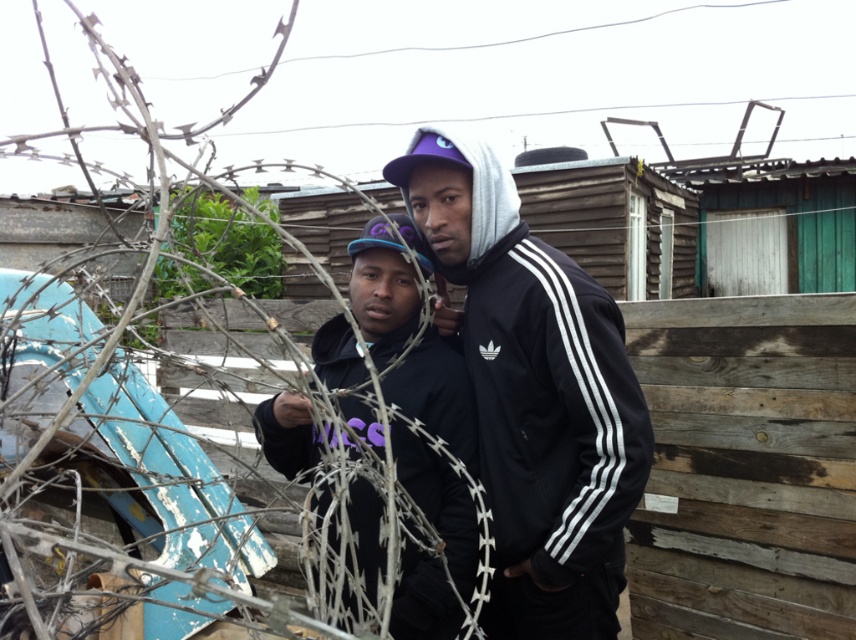
Can you confirm if weathered wood fence at right is positioned below matte black jacket at center?

Yes, weathered wood fence at right is below matte black jacket at center.

Which is in front, point (639, 544) or point (444, 204)?

Point (444, 204) is more forward.

Measure the distance between weathered wood fence at right and camera.

weathered wood fence at right is 7.60 feet away from camera.

This screenshot has height=640, width=856. Find the location of `weathered wood fence at right`. weathered wood fence at right is located at coordinates (745, 467).

Describe the element at coordinates (745, 467) in the screenshot. I see `weathered wood fence at right` at that location.

Between weathered wood fence at right and black matte hoodie at center, which one has less height?

With less height is black matte hoodie at center.

Does point (770, 358) come closer to viewer compared to point (417, 355)?

No, it is not.

In order to click on weathered wood fence at right in this screenshot , I will do `click(745, 467)`.

Between matte black jacket at center and black matte hoodie at center, which one has less height?

With less height is black matte hoodie at center.

In the scene shown: Does matte black jacket at center have a lesser width compared to black matte hoodie at center?

No.

Locate an element on the screen. This screenshot has height=640, width=856. matte black jacket at center is located at coordinates (535, 396).

The height and width of the screenshot is (640, 856). I want to click on matte black jacket at center, so click(535, 396).